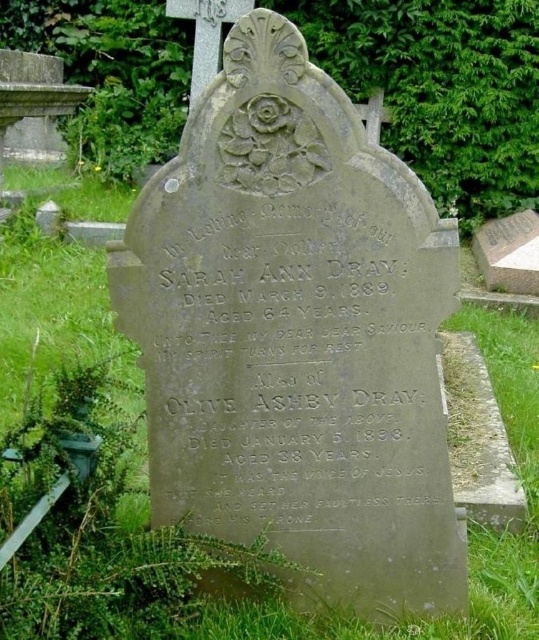
Between gray stone inscription at center and green grass at center, which one has more height?

green grass at center

Describe the element at coordinates (291, 364) in the screenshot. This screenshot has width=539, height=640. I see `gray stone inscription at center` at that location.

Where is `gray stone inscription at center`? This screenshot has height=640, width=539. gray stone inscription at center is located at coordinates (291, 364).